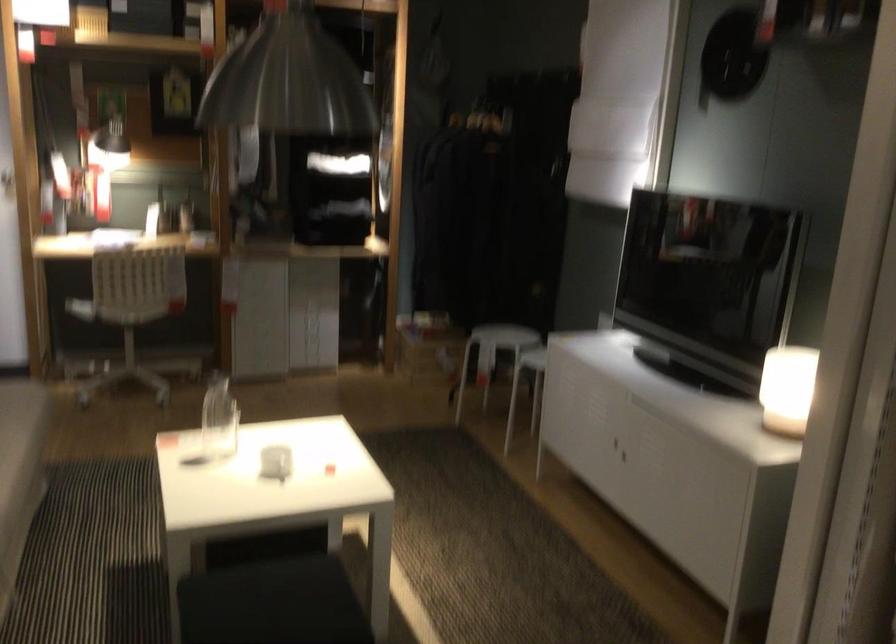
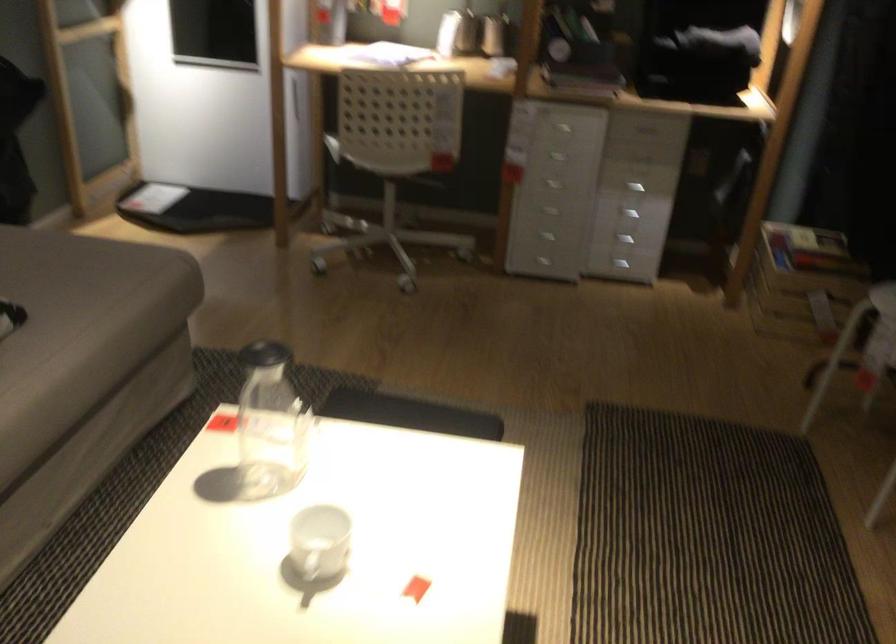
Locate, in the second image, the point that corresponds to point 312,305 in the first image.

(634, 187)